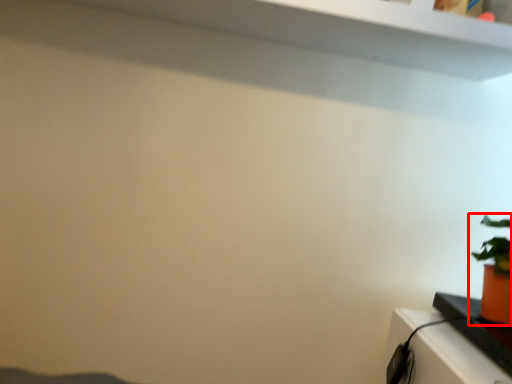
Question: From the image's perspective, what is the correct spatial relationship of houseplant (annotated by the red box) in relation to table?

Choices:
 (A) above
 (B) below

Answer: (A)